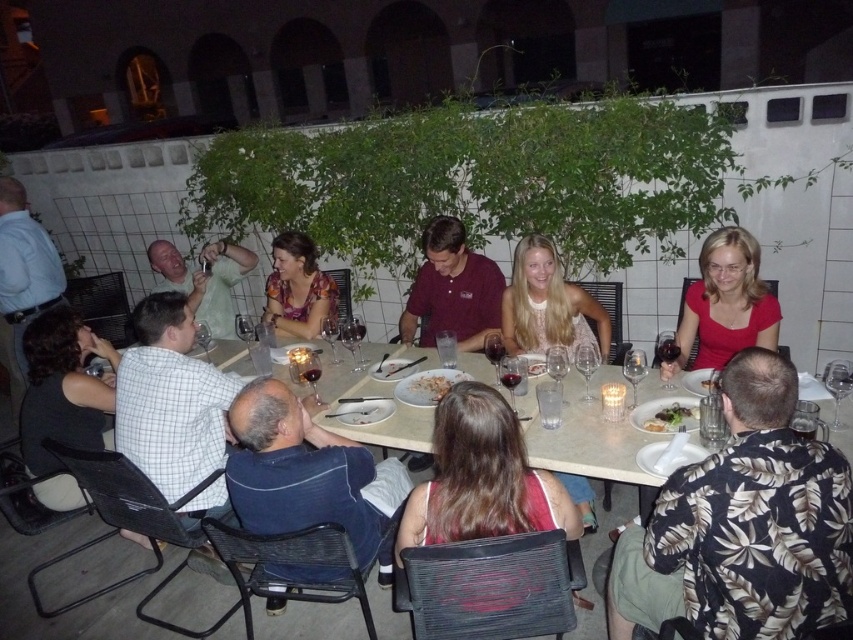
Is white glossy table at center thinner than white porcelain plate at center?

No.

Which of these two, white glossy table at center or white porcelain plate at center, stands shorter?

white porcelain plate at center

The height and width of the screenshot is (640, 853). What do you see at coordinates (74, 609) in the screenshot?
I see `white glossy table at center` at bounding box center [74, 609].

Where is `white glossy table at center`? The width and height of the screenshot is (853, 640). white glossy table at center is located at coordinates (74, 609).

Does floral print shirt at lower right have a greater width compared to white fluffy rice at center?

Indeed, floral print shirt at lower right has a greater width compared to white fluffy rice at center.

At what (x,y) coordinates should I click in order to perform the action: click on floral print shirt at lower right. Please return your answer as a coordinate pair (x, y). The height and width of the screenshot is (640, 853). Looking at the image, I should click on (743, 525).

Image resolution: width=853 pixels, height=640 pixels. I want to click on floral print shirt at lower right, so click(x=743, y=525).

Between point (747, 520) and point (380, 632), which one is positioned in front?

Point (747, 520) is more forward.

The height and width of the screenshot is (640, 853). What are the coordinates of `floral print shirt at lower right` in the screenshot? It's located at (743, 525).